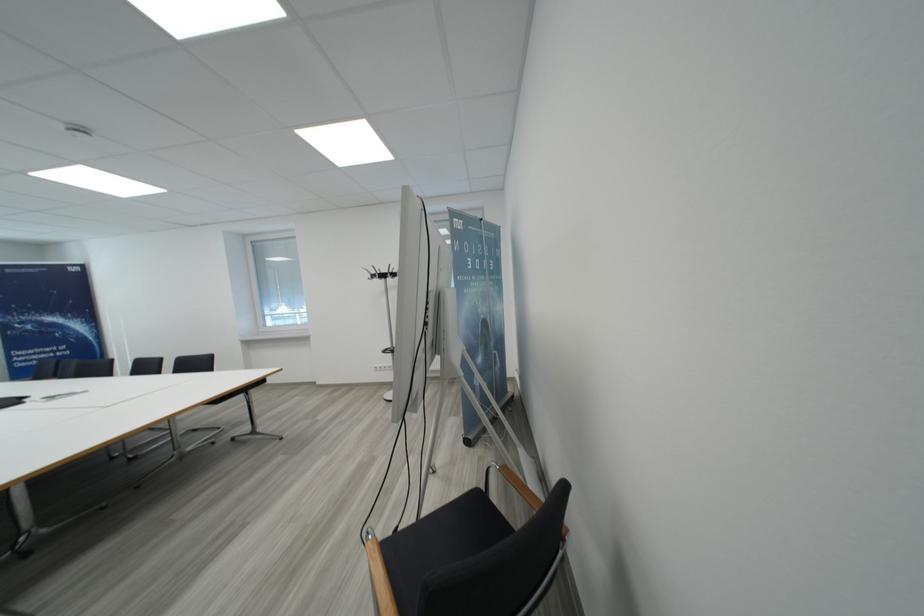
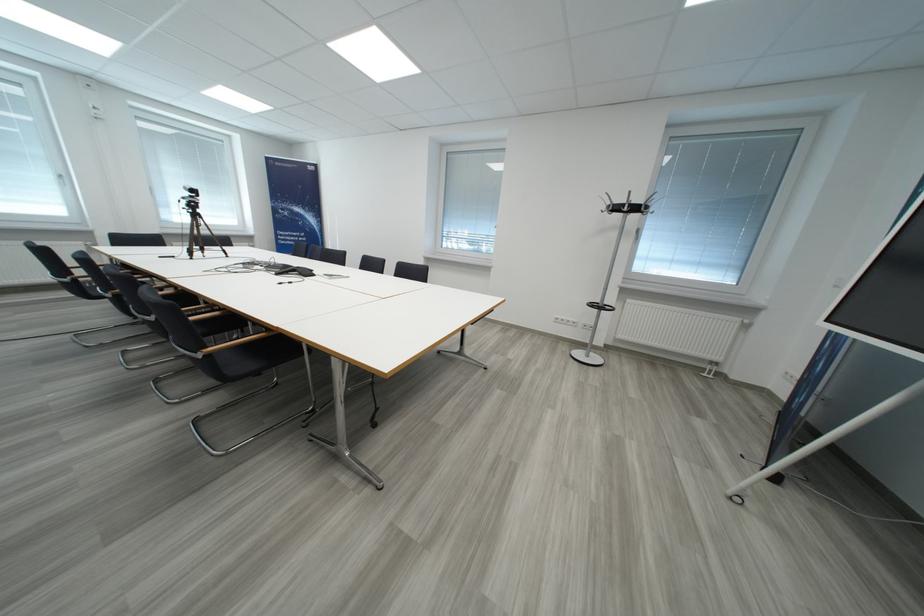
Question: Which direction would the cameraman need to move to produce the second image? Reply with the corresponding letter.

Choices:
 (A) Left
 (B) Right
 (C) Forward
 (D) Backward

Answer: (A)